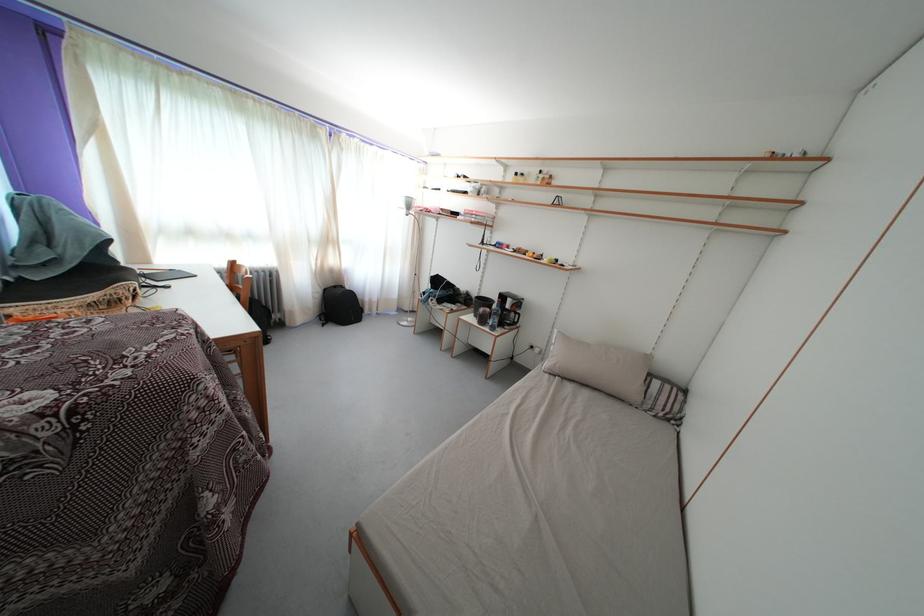
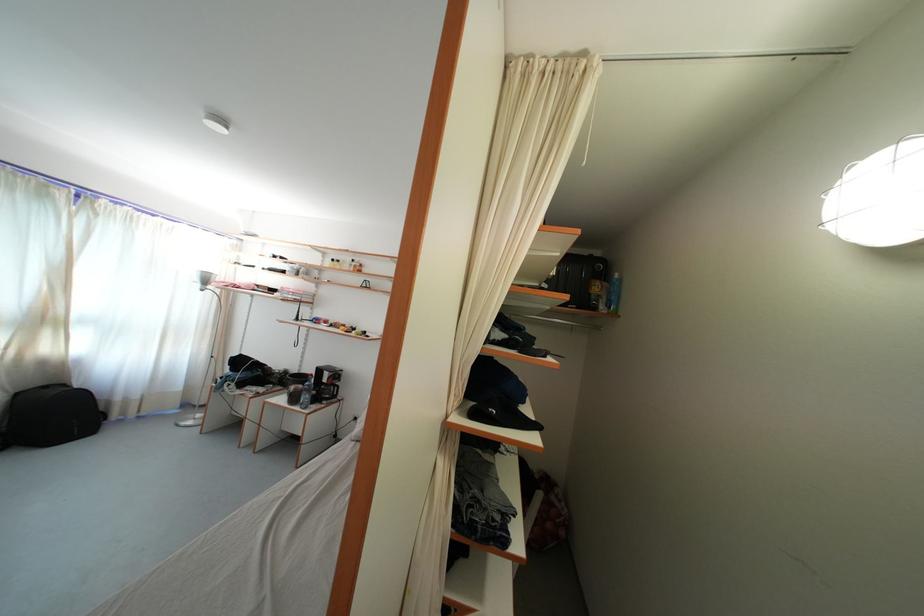
Where in the second image is the point corresponding to pixel 381 305 from the first image?

(141, 403)